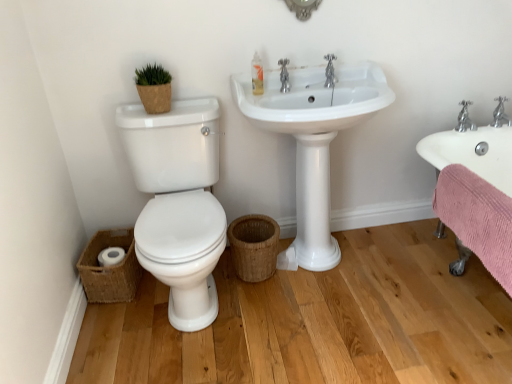
The image size is (512, 384). Find the location of `free space that is in between white glossy toilet at left and white glossy sink at center, the first sink positioned from the left`. free space that is in between white glossy toilet at left and white glossy sink at center, the first sink positioned from the left is located at coordinates click(298, 315).